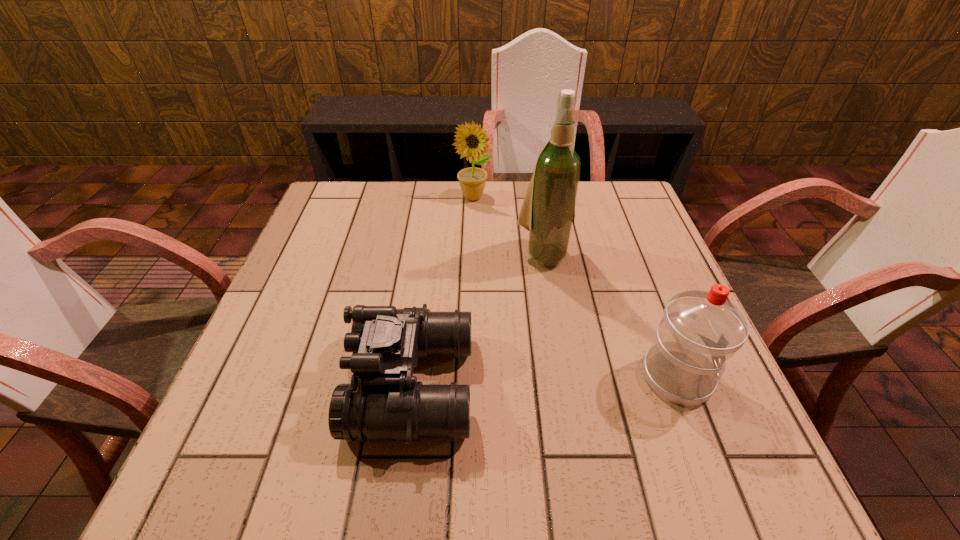
In the image, there is a desktop. Identify the location of vacant region at the near edge. (596, 409).

Identify the location of vacant space at the left edge of the desktop. This screenshot has height=540, width=960. (287, 304).

I want to click on vacant region at the right edge of the desktop, so click(x=648, y=299).

Locate an element on the screen. vacant space at the far left corner of the desktop is located at coordinates (326, 208).

This screenshot has width=960, height=540. What are the coordinates of `free space at the near left corner of the desktop` in the screenshot? It's located at (274, 410).

Locate an element on the screen. vacant space at the far right corner is located at coordinates (638, 219).

At what (x,y) coordinates should I click in order to perform the action: click on free location at the near right corner. Please return your answer as a coordinate pair (x, y). Looking at the image, I should click on (669, 420).

Find the location of a particular element. This screenshot has width=960, height=540. free space between the rightmost object and the third nearest object is located at coordinates (611, 315).

Image resolution: width=960 pixels, height=540 pixels. I want to click on empty space between the tallest object and the farthest object, so click(x=508, y=226).

Where is `unoccupied area between the third object from left to right and the sunflower`? The width and height of the screenshot is (960, 540). unoccupied area between the third object from left to right and the sunflower is located at coordinates (508, 226).